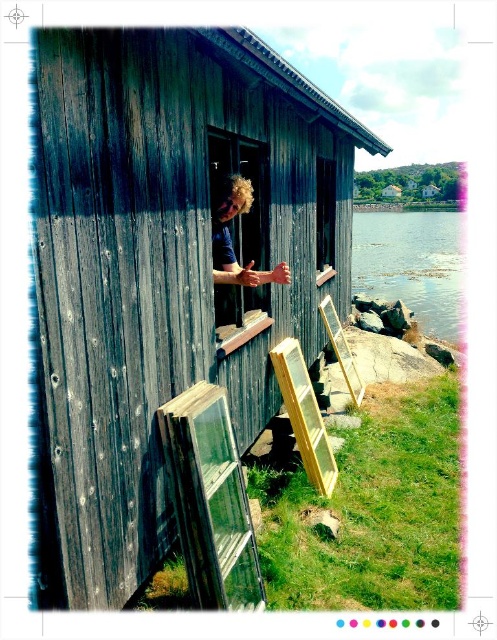
You are standing at the edge of the water and want to enter the weathered wood hut at center. According to the scene, in which direction should you move relative to the clear water at lower right to reach the hut?

The weathered wood hut at center is located below clear water at lower right, so you should move upward from the clear water at lower right to reach the weathered wood hut at center.